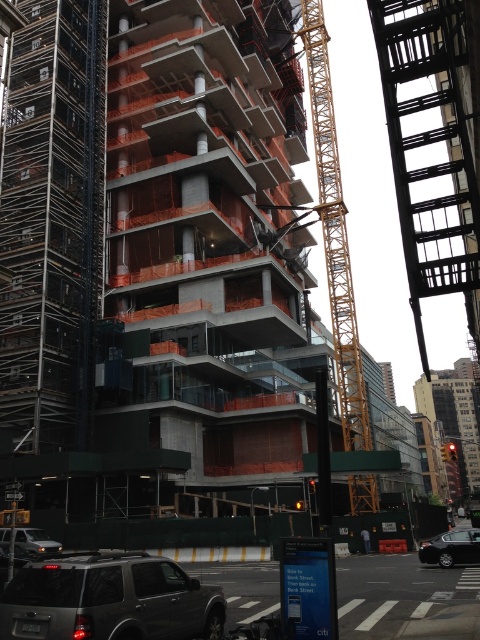
You are a delivery driver who needs to park your silver metallic car at lower left as close as possible to the entrance of the building. However, there is a metallic gray fire escape at upper right in the way. Can you park your car closer to the entrance without blocking the fire escape?

The metallic gray fire escape at upper right is positioned on the right side of the silver metallic car at lower left, so you can park the silver metallic car at lower left closer to the entrance without blocking the fire escape as long as you keep it to the left of the fire escape.

You are standing at the construction site and want to reach the point marked at coordinates [460,177]. Given that your safety harness has a maximum reach of 60 meters, can you safely reach that point without extending beyond your safety limits?

The point at coordinates [460,177] is 64.03 meters away from the viewer, which exceeds the safety harness maximum reach of 60 meters. Therefore, you cannot safely reach that point without extending beyond your safety limits.